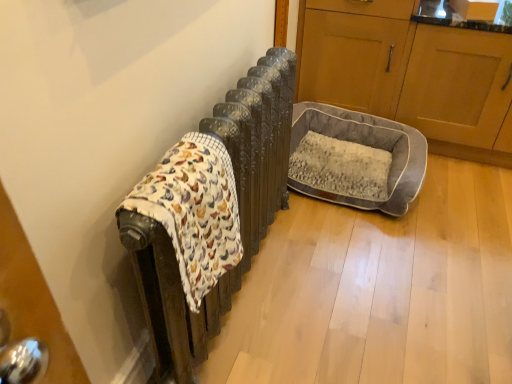
The image size is (512, 384). I want to click on free spot below fluffy cotton blanket at left (from a real-world perspective), so click(218, 355).